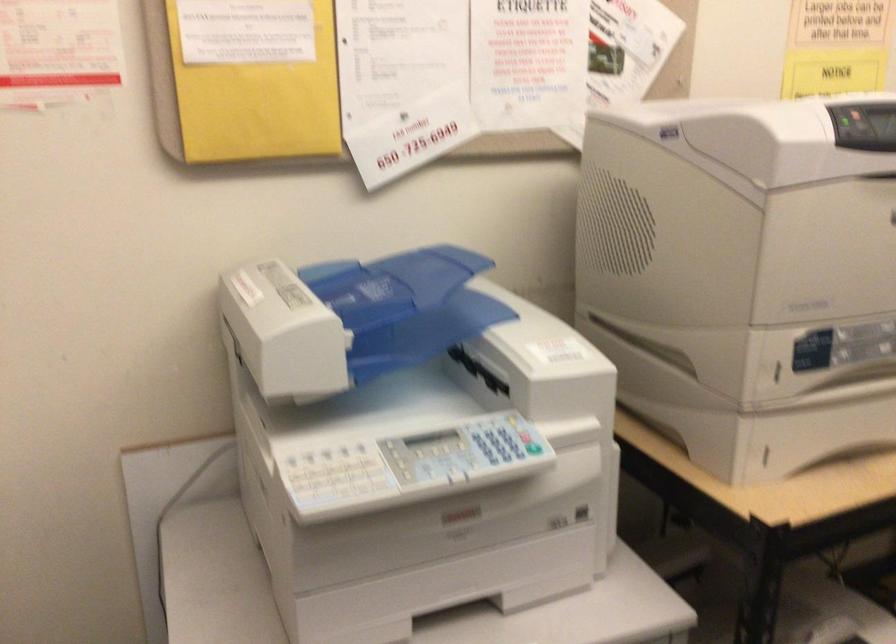
Describe the element at coordinates (533, 448) in the screenshot. Image resolution: width=896 pixels, height=644 pixels. I see `the green power button` at that location.